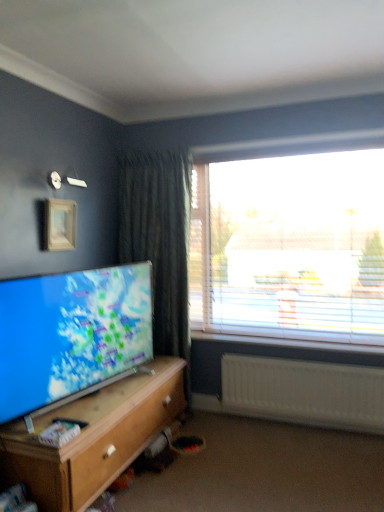
The width and height of the screenshot is (384, 512). I want to click on free space above white plastic window sill at right (from a real-world perspective), so click(263, 339).